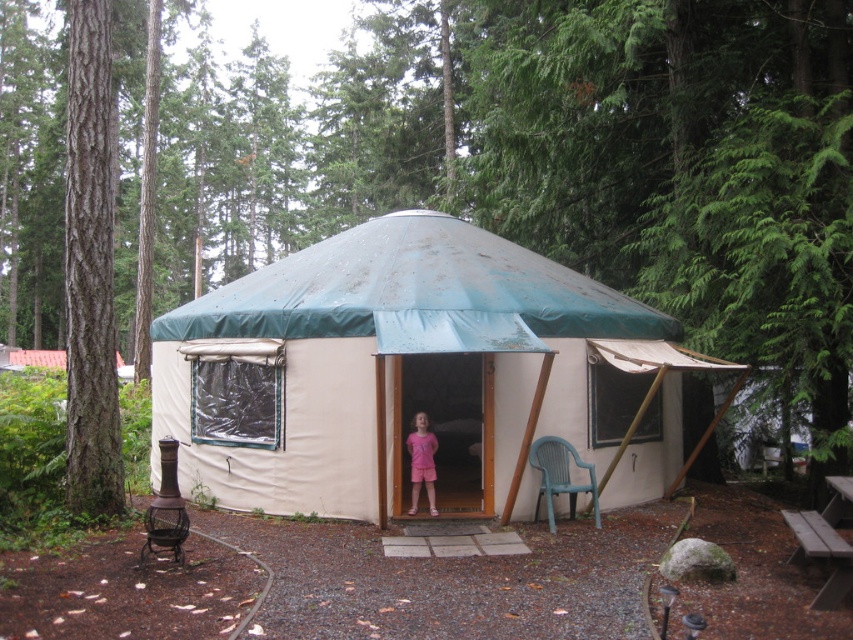
You are standing outside the yurt and want to place a small potted plant between the smooth brown bark at left and the pink fabric dress at center. Based on their positions, which object should the plant be closer to?

The smooth brown bark at left is to the left of the pink fabric dress at center, so the plant should be placed closer to the pink fabric dress at center to be between them.

You are planning to set up a camping spot near the yurt. You have the white canvas tent at center and the wooden picnic table at lower right. Which object should you move if you want to make more space for a fire pit between them?

The white canvas tent at center is smaller than the wooden picnic table at lower right, so you should move the white canvas tent at center to create more space for the fire pit between them.

You are standing 8 meters away from the white canvas tent at center. Can you enter the tent?

The distance between you and the white canvas tent at center is 8.14 meters. To enter the tent, you need to move closer to it. Since you are currently 8 meters away, you are already close enough to approach and enter the tent.